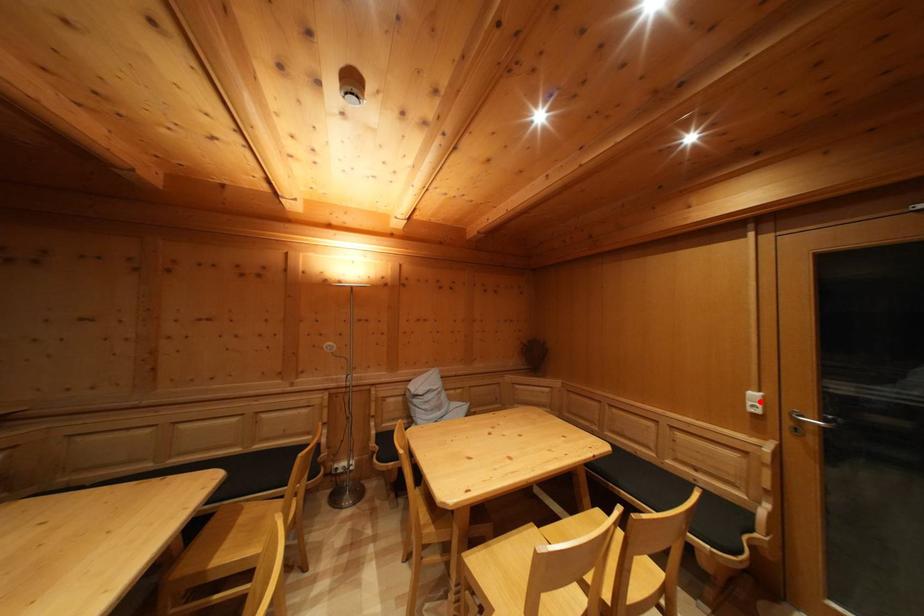
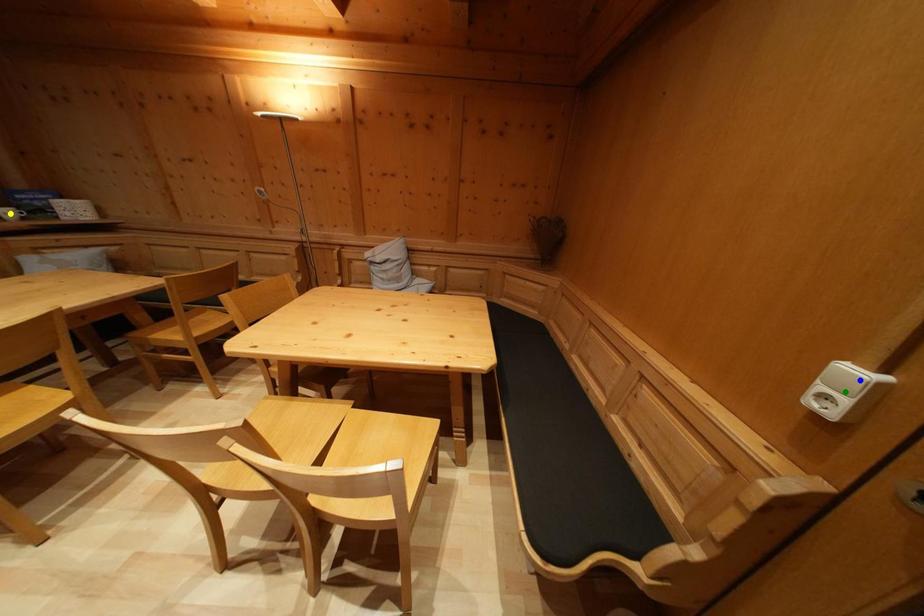
Question: I am providing you with two images of the same scene from different viewpoints. A red point is marked on the first image. You are given multiple points on the second image. Which mark in image 2 goes with the point in image 1?

Choices:
 (A) blue point
 (B) yellow point
 (C) green point

Answer: (A)